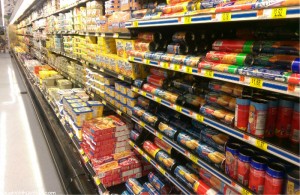
Where is `shelves`? The height and width of the screenshot is (195, 300). shelves is located at coordinates (157, 166), (179, 148), (185, 112), (201, 18).